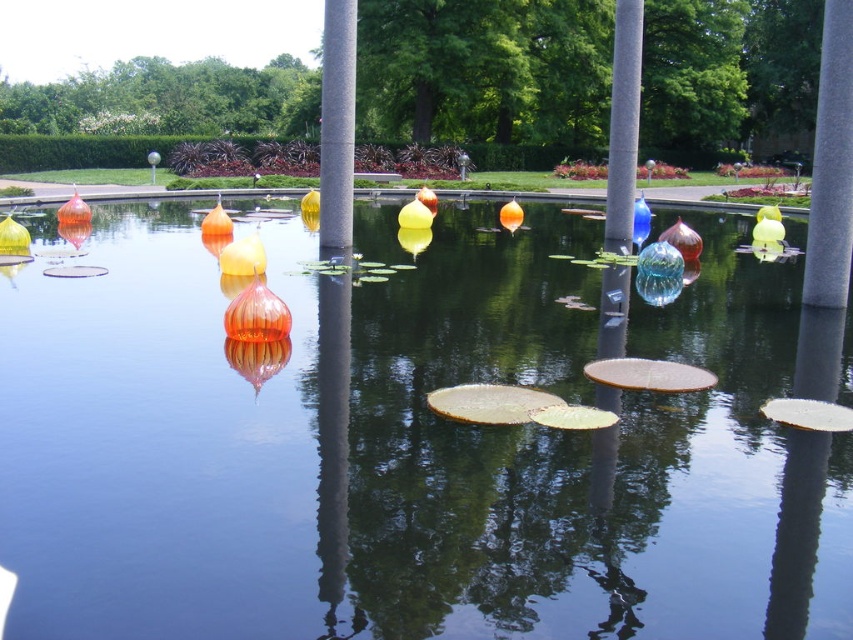
You are a photographer planning to capture the reflection of the translucent glass orbs at center and the gray stone pole at center in the water. Which object will have a shorter reflection in the water?

The translucent glass orbs at center is not as tall as the gray stone pole at center, so its reflection will be shorter.

You are standing at the edge of the water and see the point marked as point (412,440). What object is located at that point?

The translucent glass orbs at center are located at point (412,440).

You are a maintenance worker needing to reach the gray stone pole at center from the translucent glass orbs at center. Given that your reach extends 1.2 meters, can you reach the pole without moving from your current position?

The distance between the translucent glass orbs at center and the gray stone pole at center is 3.92 meters. Since your reach is only 1.2 meters, you cannot reach the pole without moving closer.